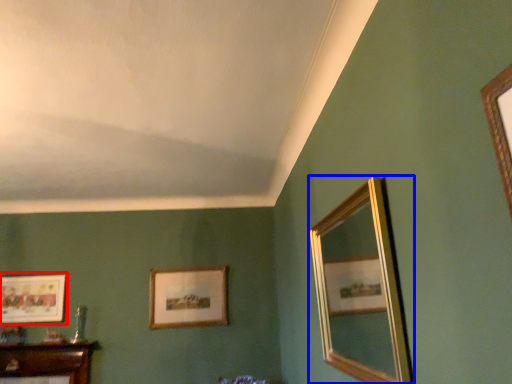
Question: Which of the following is the farthest to the observer, picture frame (highlighted by a red box) or mirror (highlighted by a blue box)?

Choices:
 (A) picture frame
 (B) mirror

Answer: (A)